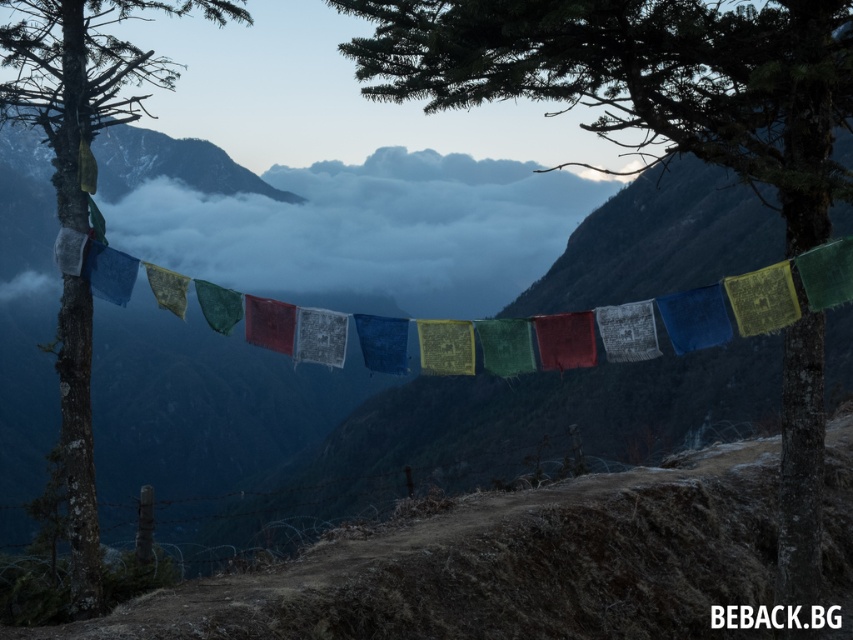
From the picture: You are standing at the base of the mountain and see the point marked at coordinates (643,77). What object is located at that point?

The point at coordinates (643,77) marks the green textured flag at center.

You are a hiker who wants to take a photo of the green textured flag at center and the smooth bark tree at left. Which object should you focus on first if you want both to be in clear focus?

The green textured flag at center is positioned on the right side of smooth bark tree at left, so you should focus on the smooth bark tree at left first to ensure both are in clear focus.

You are a hiker who just arrived at the mountain trail. You see the cloudy sky at center and the smooth bark tree at left. Which object is higher in the image?

The smooth bark tree at left is higher because the cloudy sky at center is below it.